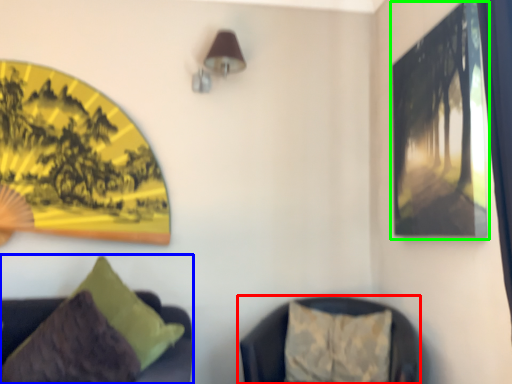
Question: Based on their relative distances, which object is farther from furniture (highlighted by a red box)? Choose from furniture (highlighted by a blue box) and picture frame (highlighted by a green box).

Choices:
 (A) furniture
 (B) picture frame

Answer: (B)